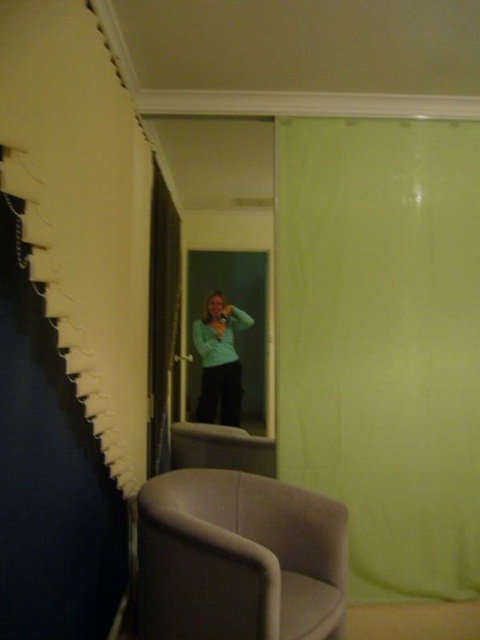
You are standing in the room depicted in the image and want to place a small decorative item between the two points labeled point [381,154] and point [227,332]. Which point should the item be closer to in order to be nearer to the viewer?

The item should be closer to point [381,154] because it is nearer to the viewer than point [227,332].

You are standing in the room and want to take a photo of the green matte shirt at center without the black velvet curtain at center blocking the view. Is the curtain in front of the shirt or behind it?

The black velvet curtain at center is closer to the viewer than the green matte shirt at center, so the curtain is in front of the shirt, blocking the view.

You are standing in the room and see the green fabric curtain at center and the green matte shirt at center. Which object is positioned to the right of the other?

The green fabric curtain at center is to the right of the green matte shirt at center.